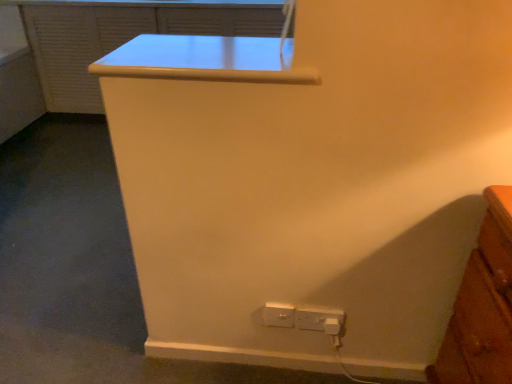
Question: Can you confirm if white plastic power plugs and sockets at lower center, acting as the first power plugs and sockets starting from the left, is positioned to the right of matte white file cabinet at upper center?

Choices:
 (A) yes
 (B) no

Answer: (A)

Question: Is white plastic power plugs and sockets at lower center, acting as the first power plugs and sockets starting from the left, outside of matte white file cabinet at upper center?

Choices:
 (A) yes
 (B) no

Answer: (A)

Question: From a real-world perspective, is white plastic power plugs and sockets at lower center, acting as the first power plugs and sockets starting from the left, beneath matte white file cabinet at upper center?

Choices:
 (A) yes
 (B) no

Answer: (A)

Question: Can you see white plastic power plugs and sockets at lower center, positioned as the second power plugs and sockets in right-to-left order, touching matte white file cabinet at upper center?

Choices:
 (A) no
 (B) yes

Answer: (A)

Question: Is matte white file cabinet at upper center a part of white plastic power plugs and sockets at lower center, acting as the first power plugs and sockets starting from the left?

Choices:
 (A) yes
 (B) no

Answer: (B)

Question: Can you confirm if white plastic power plugs and sockets at lower center, acting as the first power plugs and sockets starting from the left, is smaller than matte white file cabinet at upper center?

Choices:
 (A) no
 (B) yes

Answer: (B)

Question: Is white glossy table at upper center inside matte white file cabinet at upper center?

Choices:
 (A) yes
 (B) no

Answer: (B)

Question: Considering the relative sizes of matte white file cabinet at upper center and white glossy table at upper center in the image provided, is matte white file cabinet at upper center bigger than white glossy table at upper center?

Choices:
 (A) no
 (B) yes

Answer: (B)

Question: Is matte white file cabinet at upper center at the left side of white glossy table at upper center?

Choices:
 (A) yes
 (B) no

Answer: (A)

Question: Is matte white file cabinet at upper center outside of white glossy table at upper center?

Choices:
 (A) yes
 (B) no

Answer: (A)

Question: Would you consider matte white file cabinet at upper center to be distant from white glossy table at upper center?

Choices:
 (A) no
 (B) yes

Answer: (B)

Question: Does matte white file cabinet at upper center turn towards white glossy table at upper center?

Choices:
 (A) no
 (B) yes

Answer: (B)

Question: Is white plastic power plugs and sockets at lower center, positioned as the second power plugs and sockets in right-to-left order, located within matte white file cabinet at upper center?

Choices:
 (A) yes
 (B) no

Answer: (B)